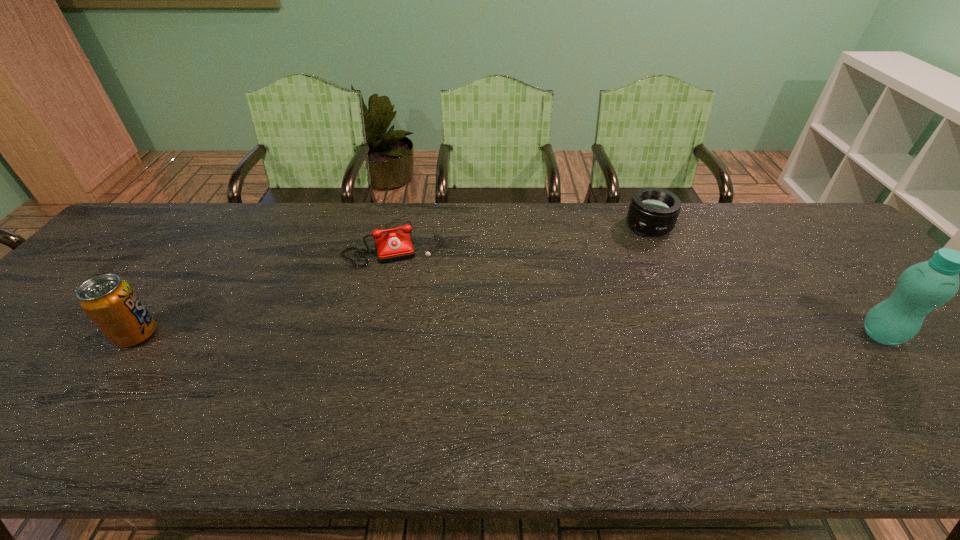
You are a GUI agent. You are given a task and a screenshot of the screen. Output one action in this format:
    pyautogui.click(x=<x>, y=<y>)
    Task: Click on the free region located 0.050m on the dial of the telephone
    
    Given the screenshot: What is the action you would take?
    pyautogui.click(x=407, y=279)

The image size is (960, 540). Find the location of `free space located 0.120m on the dial of the telephone`. free space located 0.120m on the dial of the telephone is located at coordinates (411, 296).

Locate an element on the screen. vacant region located 0.180m on the side of the telephoto lens with brand markings and control switches is located at coordinates (625, 272).

In order to click on vacant space situated 0.260m on the side of the telephoto lens with brand markings and control switches in this screenshot , I will do `click(616, 289)`.

You are a GUI agent. You are given a task and a screenshot of the screen. Output one action in this format:
    pyautogui.click(x=<x>, y=<y>)
    Task: Click on the vacant space located 0.390m on the side of the telephoto lens with brand markings and control switches
    This screenshot has width=960, height=540.
    Given the screenshot: What is the action you would take?
    pyautogui.click(x=600, y=321)

Locate an element on the screen. This screenshot has height=540, width=960. telephone present at the far edge is located at coordinates (392, 246).

At what (x,y) coordinates should I click in order to perform the action: click on telephoto lens located at the far edge. Please return your answer as a coordinate pair (x, y). Looking at the image, I should click on (653, 211).

I want to click on object present at the right edge, so click(x=921, y=288).

At what (x,y) coordinates should I click in order to perform the action: click on vacant space at the far edge of the desktop. Please return your answer as a coordinate pair (x, y). Looking at the image, I should click on (323, 233).

Where is `vacant space at the near edge of the desktop`? This screenshot has height=540, width=960. vacant space at the near edge of the desktop is located at coordinates (483, 393).